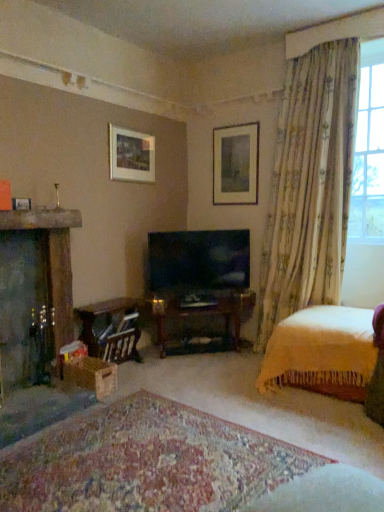
Question: From the image's perspective, does translucent floral curtains at right appear lower than wooden table at lower left?

Choices:
 (A) yes
 (B) no

Answer: (B)

Question: Is translucent floral curtains at right to the left of wooden table at lower left from the viewer's perspective?

Choices:
 (A) yes
 (B) no

Answer: (B)

Question: Is translucent floral curtains at right facing away from wooden table at lower left?

Choices:
 (A) yes
 (B) no

Answer: (B)

Question: Does translucent floral curtains at right have a smaller size compared to wooden table at lower left?

Choices:
 (A) yes
 (B) no

Answer: (B)

Question: Can you confirm if translucent floral curtains at right is positioned to the right of wooden table at lower left?

Choices:
 (A) no
 (B) yes

Answer: (B)

Question: Can you confirm if translucent floral curtains at right is bigger than wooden table at lower left?

Choices:
 (A) no
 (B) yes

Answer: (B)

Question: Considering the relative positions of matte black tv at center and floral fabric curtain at upper right in the image provided, is matte black tv at center to the left of floral fabric curtain at upper right from the viewer's perspective?

Choices:
 (A) yes
 (B) no

Answer: (A)

Question: Does matte black tv at center have a smaller size compared to floral fabric curtain at upper right?

Choices:
 (A) yes
 (B) no

Answer: (A)

Question: Does matte black tv at center appear on the right side of floral fabric curtain at upper right?

Choices:
 (A) yes
 (B) no

Answer: (B)

Question: Can you see matte black tv at center touching floral fabric curtain at upper right?

Choices:
 (A) no
 (B) yes

Answer: (A)

Question: From the image's perspective, is matte black tv at center above floral fabric curtain at upper right?

Choices:
 (A) no
 (B) yes

Answer: (A)

Question: From a real-world perspective, is matte black tv at center positioned under floral fabric curtain at upper right based on gravity?

Choices:
 (A) no
 (B) yes

Answer: (B)

Question: Does matte white picture frame at upper center, acting as the second picture frame starting from the right, contain yellow knitted blanket at lower right?

Choices:
 (A) no
 (B) yes

Answer: (A)